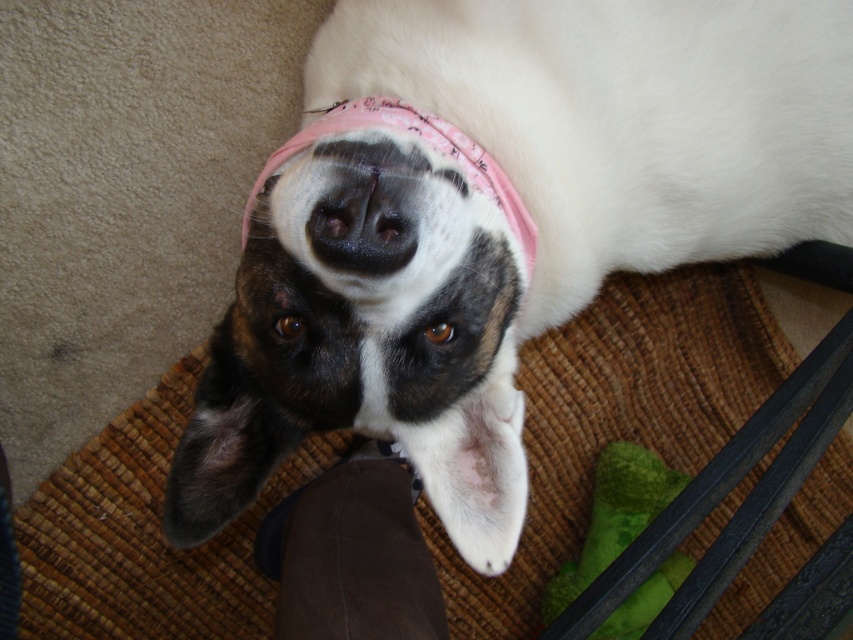
Between point (592, 493) and point (340, 173), which one is positioned behind?

Point (592, 493)

Does green rubber bone at lower right appear on the right side of black smooth nose at center?

Correct, you'll find green rubber bone at lower right to the right of black smooth nose at center.

Image resolution: width=853 pixels, height=640 pixels. Describe the element at coordinates (613, 516) in the screenshot. I see `green rubber bone at lower right` at that location.

The height and width of the screenshot is (640, 853). Identify the location of green rubber bone at lower right. (613, 516).

At what (x,y) coordinates should I click in order to perform the action: click on white soft fur at center. Please return your answer as a coordinate pair (x, y). Looking at the image, I should click on pyautogui.click(x=505, y=221).

Can you confirm if white soft fur at center is bigger than pink fabric bandana at center?

Indeed, white soft fur at center has a larger size compared to pink fabric bandana at center.

The height and width of the screenshot is (640, 853). I want to click on white soft fur at center, so click(505, 221).

Where is `white soft fur at center`? This screenshot has height=640, width=853. white soft fur at center is located at coordinates point(505,221).

Does white soft fur at center appear on the right side of green rubber bone at lower right?

No, white soft fur at center is not to the right of green rubber bone at lower right.

Describe the element at coordinates (505, 221) in the screenshot. I see `white soft fur at center` at that location.

You are a GUI agent. You are given a task and a screenshot of the screen. Output one action in this format:
    pyautogui.click(x=<x>, y=<y>)
    Task: Click on the white soft fur at center
    The height and width of the screenshot is (640, 853).
    Given the screenshot: What is the action you would take?
    pyautogui.click(x=505, y=221)